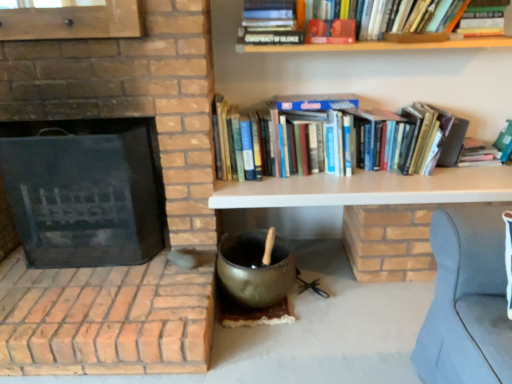
Describe the element at coordinates (83, 191) in the screenshot. I see `black matte fireplace at left` at that location.

This screenshot has height=384, width=512. What do you see at coordinates (255, 269) in the screenshot? I see `matte black wok at center` at bounding box center [255, 269].

Where is `hardcover books at upper right`? This screenshot has width=512, height=384. hardcover books at upper right is located at coordinates (340, 138).

Does white matte shelf at upper center appear on the left side of hardcover books at upper right?

Incorrect, white matte shelf at upper center is not on the left side of hardcover books at upper right.

Is white matte shelf at upper center with hardcover books at upper right?

white matte shelf at upper center and hardcover books at upper right are not in contact.

Is point (241, 261) positioned after point (230, 174)?

No, it is in front of (230, 174).

In the scene shown: Visually, is matte black wok at center positioned to the left or to the right of hardcover books at upper right?

matte black wok at center is positioned on hardcover books at upper right's left side.

In the image, is matte black wok at center positioned in front of or behind hardcover books at upper right?

Clearly, matte black wok at center is in front of hardcover books at upper right.

Is matte black wok at center touching hardcover books at upper right?

No, matte black wok at center is not next to hardcover books at upper right.

Is hardcover books at upper right facing towards white matte shelf at upper center?

No, hardcover books at upper right is not turned towards white matte shelf at upper center.

Can you confirm if hardcover books at upper right is thinner than white matte shelf at upper center?

Indeed, hardcover books at upper right has a lesser width compared to white matte shelf at upper center.

Is point (361, 160) farther from camera compared to point (226, 190)?

Yes, it is.

Which is more to the left, hardcover books at upper right or white matte shelf at upper center?

hardcover books at upper right.

Between black matte fireplace at left and hardcover books at upper right, which one appears on the left side from the viewer's perspective?

From the viewer's perspective, black matte fireplace at left appears more on the left side.

Considering the sizes of objects black matte fireplace at left and hardcover books at upper right in the image provided, who is bigger, black matte fireplace at left or hardcover books at upper right?

Bigger between the two is black matte fireplace at left.

Between black matte fireplace at left and hardcover books at upper right, which one has less height?

hardcover books at upper right.

Is black matte fireplace at left far from hardcover books at upper right?

That's not correct — black matte fireplace at left is a little close to hardcover books at upper right.

Locate an element on the screen. This screenshot has width=512, height=384. fireplace in front of the matte black wok at center is located at coordinates (83, 191).

Consider the image. Considering the relative sizes of matte black wok at center and black matte fireplace at left in the image provided, is matte black wok at center taller than black matte fireplace at left?

No, matte black wok at center is not taller than black matte fireplace at left.

Who is smaller, matte black wok at center or black matte fireplace at left?

matte black wok at center is smaller.

What's the angular difference between white matte shelf at upper center and black matte fireplace at left's facing directions?

0.199 degrees separate the facing orientations of white matte shelf at upper center and black matte fireplace at left.

From the image's perspective, which object appears higher, white matte shelf at upper center or black matte fireplace at left?

black matte fireplace at left is shown above in the image.

Between white matte shelf at upper center and black matte fireplace at left, which one has larger width?

With larger width is black matte fireplace at left.

Is white matte shelf at upper center at the left side of black matte fireplace at left?

No, white matte shelf at upper center is not to the left of black matte fireplace at left.

Between hardcover books at upper right and matte black wok at center, which one is positioned in front?

matte black wok at center is more forward.

Is hardcover books at upper right at the left side of matte black wok at center?

No.

Is matte black wok at center at the back of hardcover books at upper right?

hardcover books at upper right does not have its back to matte black wok at center.

Between point (269, 161) and point (282, 281), which one is positioned in front?

The point (282, 281) is more forward.

I want to click on book above the white matte shelf at upper center (from a real-world perspective), so click(x=340, y=138).

I want to click on wok that appears below the hardcover books at upper right (from a real-world perspective), so pos(255,269).

Which object lies nearer to the anchor point matte black wok at center, hardcover books at upper right or black matte fireplace at left?

hardcover books at upper right is positioned closer to the anchor matte black wok at center.

Estimate the real-world distances between objects in this image. Which object is closer to white matte shelf at upper center, hardcover books at upper right or matte black wok at center?

Among the two, hardcover books at upper right is located nearer to white matte shelf at upper center.

Looking at the image, which one is located closer to black matte fireplace at left, matte black wok at center or white matte shelf at upper center?

Based on the image, matte black wok at center appears to be nearer to black matte fireplace at left.

Considering their positions, is matte black wok at center positioned further to hardcover books at upper right than white matte shelf at upper center?

Based on the image, matte black wok at center appears to be further to hardcover books at upper right.

From the image, which object appears to be nearer to matte black wok at center, white matte shelf at upper center or hardcover books at upper right?

Based on the image, white matte shelf at upper center appears to be nearer to matte black wok at center.

Estimate the real-world distances between objects in this image. Which object is further from hardcover books at upper right, matte black wok at center or black matte fireplace at left?

The object further to hardcover books at upper right is black matte fireplace at left.

When comparing their distances from white matte shelf at upper center, does hardcover books at upper right or black matte fireplace at left seem closer?

Based on the image, hardcover books at upper right appears to be nearer to white matte shelf at upper center.

Based on their spatial positions, is white matte shelf at upper center or matte black wok at center further from hardcover books at upper right?

matte black wok at center is further to hardcover books at upper right.

Image resolution: width=512 pixels, height=384 pixels. I want to click on book between black matte fireplace at left and white matte shelf at upper center from left to right, so click(340, 138).

The image size is (512, 384). Identify the location of wok situated between black matte fireplace at left and white matte shelf at upper center from left to right. (255, 269).

The width and height of the screenshot is (512, 384). Identify the location of table that lies between hardcover books at upper right and matte black wok at center from top to bottom. (368, 189).

In order to click on wok situated between black matte fireplace at left and hardcover books at upper right from left to right in this screenshot , I will do `click(255, 269)`.